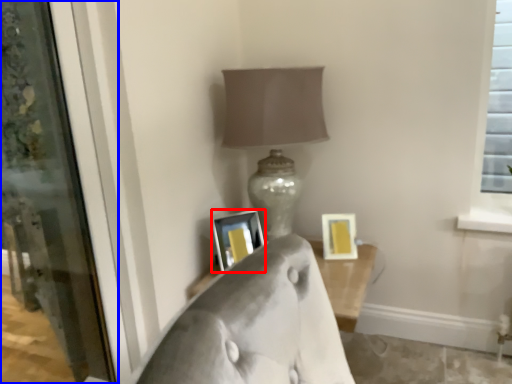
Question: Which of the following is the closest to the observer, picture frame (highlighted by a red box) or screen door (highlighted by a blue box)?

Choices:
 (A) picture frame
 (B) screen door

Answer: (B)